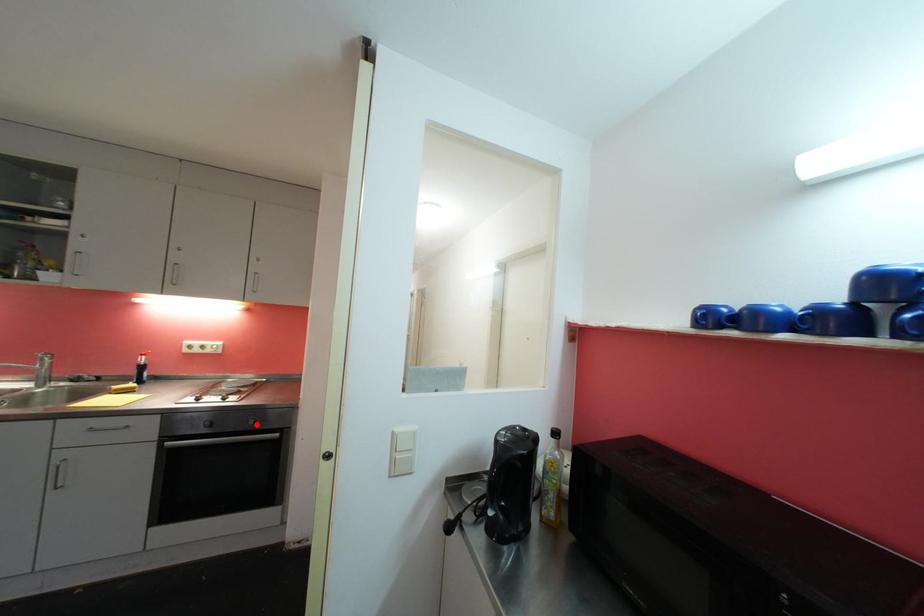
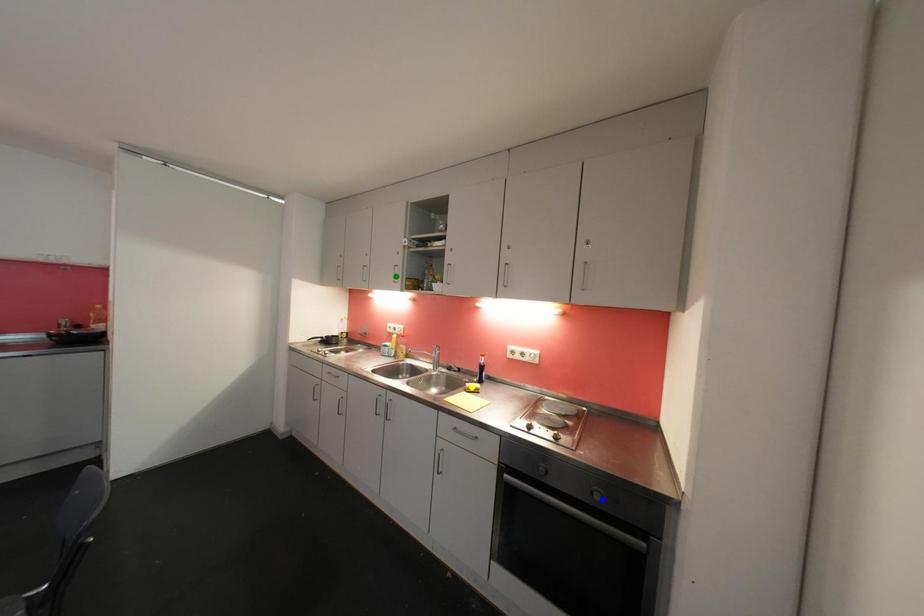
Question: I am providing you with two images of the same scene from different viewpoints. A red point is marked on the first image. You are given multiple points on the second image. Which mark in image 2 goes with the point in image 1?

Choices:
 (A) blue point
 (B) green point
 (C) yellow point

Answer: (A)